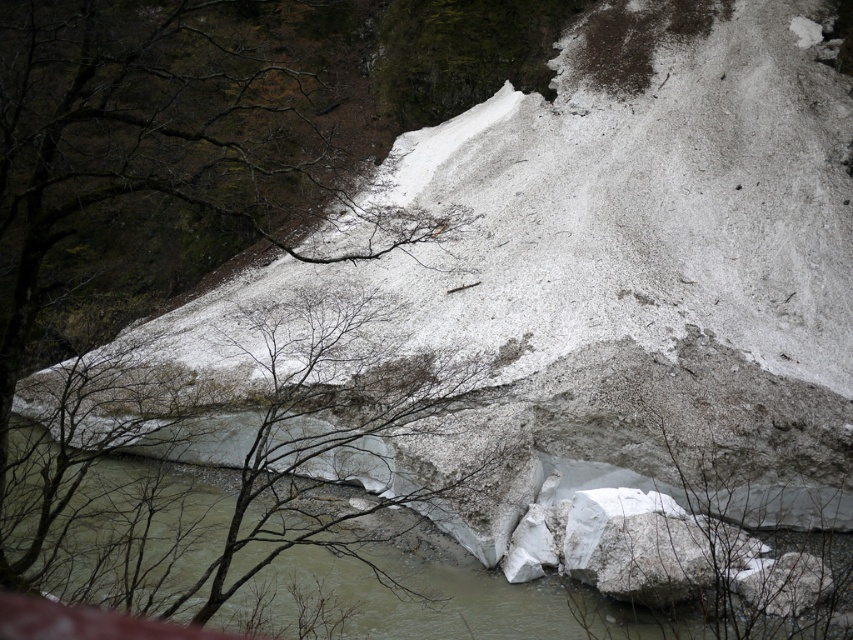
Question: Which point is farther to the camera?

Choices:
 (A) (257, 360)
 (B) (115, 536)

Answer: (A)

Question: Among these points, which one is farthest from the camera?

Choices:
 (A) (666, 566)
 (B) (357, 627)
 (C) (355, 339)

Answer: (C)

Question: Can you confirm if bare branches at center is positioned to the right of white ice at center?

Choices:
 (A) no
 (B) yes

Answer: (A)

Question: Is bare branches at center in front of white snow-covered rock at lower right?

Choices:
 (A) no
 (B) yes

Answer: (B)

Question: Which of the following is the farthest from the observer?

Choices:
 (A) white snow-covered rock at lower right
 (B) white ice at center
 (C) bare branches at center

Answer: (A)

Question: Can you confirm if bare branches at center is wider than white ice at center?

Choices:
 (A) yes
 (B) no

Answer: (B)